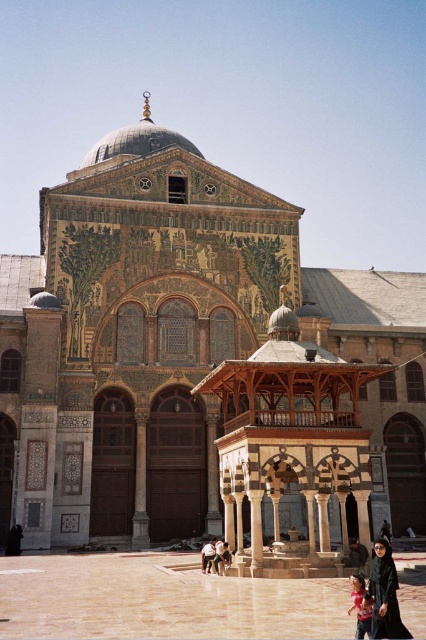
You are a visitor at the mosque and want to take a photo of the wooden pavilion at center and the matte black dress at lower right. Which object should you focus on first if you want to capture both in the same frame without moving the camera?

The wooden pavilion at center is much taller than the matte black dress at lower right, so you should focus on the wooden pavilion at center first to ensure it fits entirely in the frame while still capturing the matte black dress at lower right.

You are standing in front of the grand mosque and see the wooden pavilion at center and the matte black dress at lower right. Which object is positioned to the right side of the other?

The wooden pavilion at center is to the right of the matte black dress at lower right.

You are a tourist standing at the base of the structure. You want to take a photo of the mosaic tile church at center without the black fabric person at lower right appearing in the shot. Is this possible based on their positions?

The mosaic tile church at center is located above the black fabric person at lower right, so if you position yourself so that the church is framed above the person, you can take a photo of the mosaic tile church at center without the black fabric person at lower right appearing in the shot.